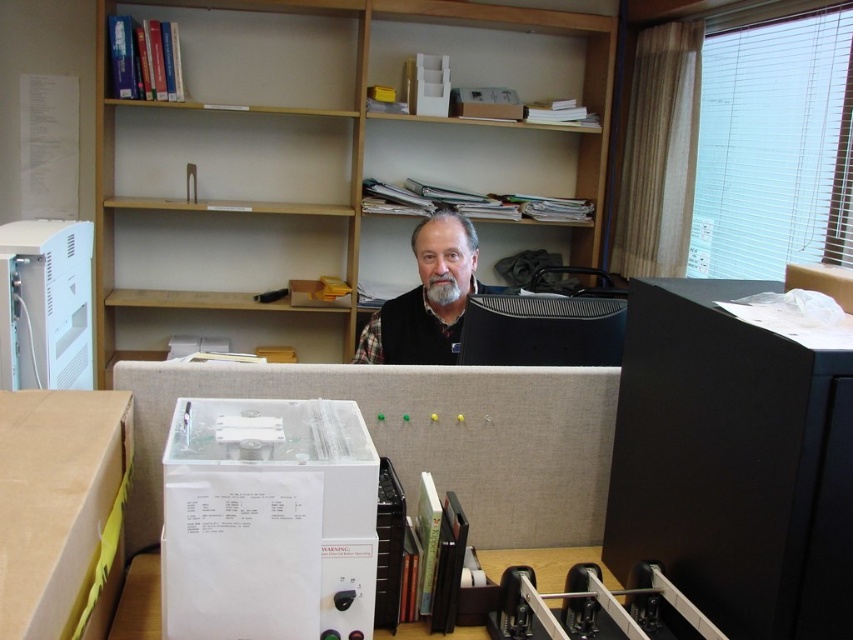
Who is shorter, black plastic file cabinet at right or white plastic box at center?

With less height is white plastic box at center.

Between black plastic file cabinet at right and white plastic box at center, which one appears on the right side from the viewer's perspective?

black plastic file cabinet at right is more to the right.

Who is more distant from viewer, (822, 376) or (338, 545)?

Point (338, 545)

The height and width of the screenshot is (640, 853). I want to click on black plastic file cabinet at right, so click(x=733, y=464).

Does white plastic box at lower left have a greater height compared to white plastic computer at left?

No, white plastic box at lower left is not taller than white plastic computer at left.

Which is more to the left, white plastic box at lower left or white plastic computer at left?

white plastic computer at left is more to the left.

Image resolution: width=853 pixels, height=640 pixels. In order to click on white plastic box at lower left in this screenshot , I will do `click(61, 509)`.

Is white plastic box at center to the left of gray knit sweater at center from the viewer's perspective?

Correct, you'll find white plastic box at center to the left of gray knit sweater at center.

This screenshot has height=640, width=853. Find the location of `white plastic box at center`. white plastic box at center is located at coordinates (268, 520).